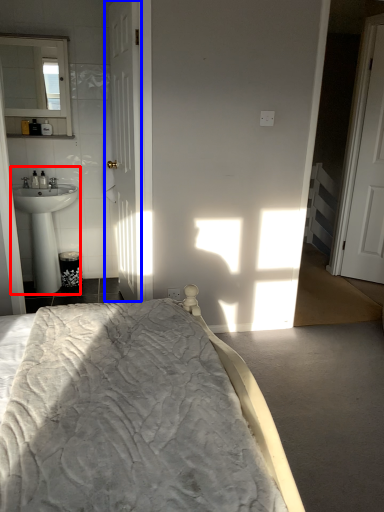
Question: Which object appears farthest to the camera in this image, sink (highlighted by a red box) or door (highlighted by a blue box)?

Choices:
 (A) sink
 (B) door

Answer: (A)